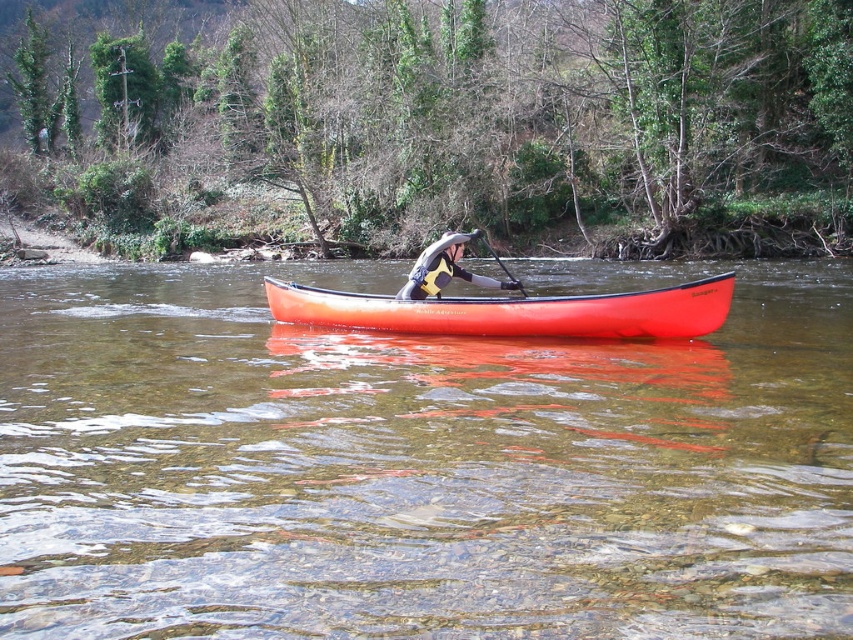
You are a photographer trying to capture the orange matte canoe at center and the black rubber paddle at center in a single shot. Based on their positions, which object should you focus on first to ensure both are in frame?

The orange matte canoe at center is positioned on the right side of black rubber paddle at center, so you should focus on the black rubber paddle at center first to ensure both objects are within the frame.

You are a photographer trying to capture the orange matte canoe at center and the black rubber paddle at center from above. Based on their positions, which object should appear higher in your photo?

The black rubber paddle at center appears higher in the photo because the orange matte canoe at center is positioned below it.